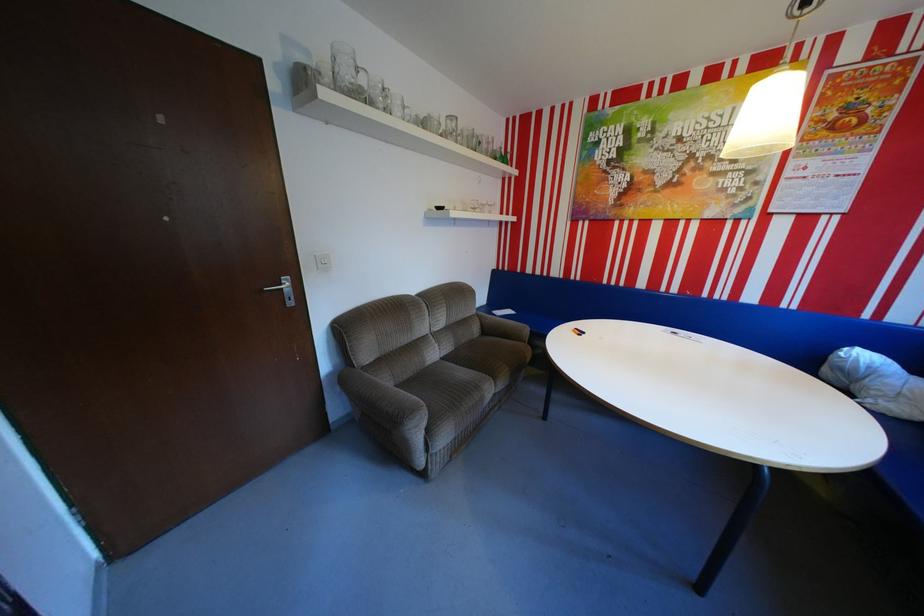
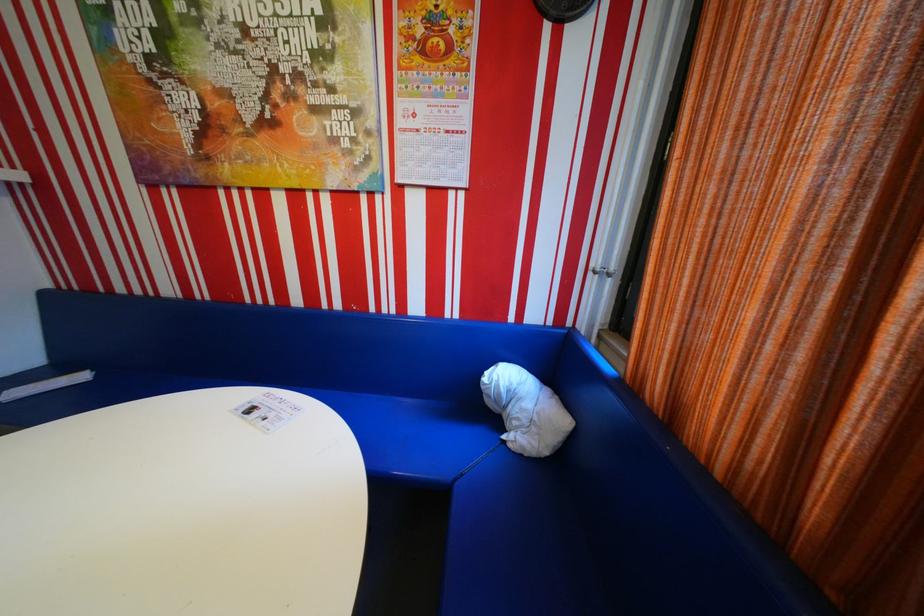
Locate, in the second image, the point that corresponds to point (852, 368) in the first image.

(502, 395)